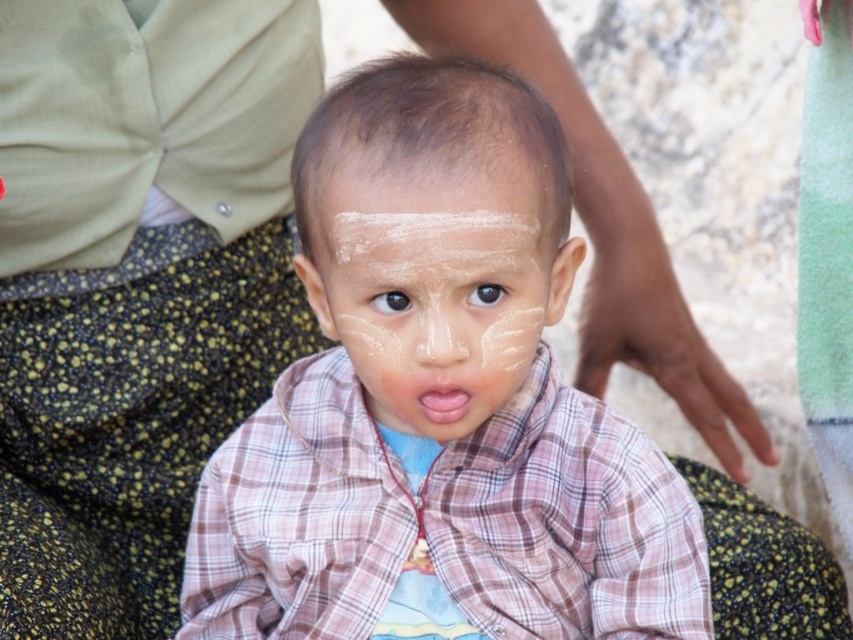
You are a photographer trying to capture a closeup of the child in the scene. The smooth plaid shirt at center and the black matte eye at center are both in your viewfinder. Which object should you focus on to ensure the other is in the background?

You should focus on the smooth plaid shirt at center because it is in front of the black matte eye at center, so if you focus on the smooth plaid shirt at center, the black matte eye at center will be in the background.